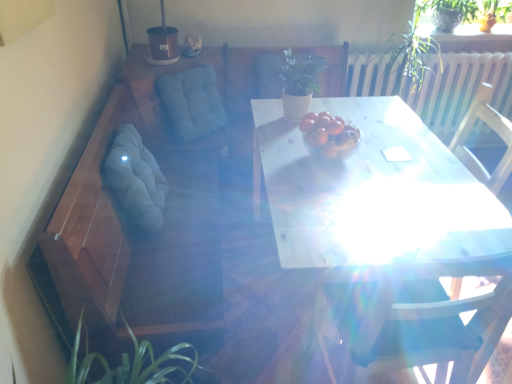
Question: Could you tell me if soft gray fabric swivel chair at left, the second swivel chair from the back, is facing blue fabric cushion at upper left, which appears as the second swivel chair when viewed from the front?

Choices:
 (A) no
 (B) yes

Answer: (A)

Question: Is soft gray fabric swivel chair at left, the second swivel chair from the back, thinner than blue fabric cushion at upper left, which appears as the second swivel chair when viewed from the front?

Choices:
 (A) yes
 (B) no

Answer: (A)

Question: Is soft gray fabric swivel chair at left, marked as the first swivel chair in a front-to-back arrangement, beside blue fabric cushion at upper left, which appears as the 1th swivel chair when viewed from the back?

Choices:
 (A) no
 (B) yes

Answer: (A)

Question: Is blue fabric cushion at upper left, which appears as the second swivel chair when viewed from the front, a part of soft gray fabric swivel chair at left, the second swivel chair from the back?

Choices:
 (A) yes
 (B) no

Answer: (B)

Question: Is soft gray fabric swivel chair at left, the second swivel chair from the back, shorter than blue fabric cushion at upper left, which appears as the 1th swivel chair when viewed from the back?

Choices:
 (A) yes
 (B) no

Answer: (B)

Question: Considering the positions of white glossy table at center and green leafy plant at upper right, the 2th plant positioned from the bottom, in the image, is white glossy table at center wider or thinner than green leafy plant at upper right, the 2th plant positioned from the bottom,?

Choices:
 (A) thin
 (B) wide

Answer: (B)

Question: Considering their positions, is white glossy table at center located in front of or behind green leafy plant at upper right, the 2th plant positioned from the bottom?

Choices:
 (A) behind
 (B) front

Answer: (B)

Question: Considering the positions of point (355, 256) and point (481, 16), is point (355, 256) closer or farther from the camera than point (481, 16)?

Choices:
 (A) farther
 (B) closer

Answer: (B)

Question: From a real-world perspective, is white glossy table at center above or below green leafy plant at upper right, the 2th plant positioned from the bottom?

Choices:
 (A) above
 (B) below

Answer: (B)

Question: Based on their positions, is green fabric armchair at upper center located to the left or right of translucent glass bowl at center?

Choices:
 (A) left
 (B) right

Answer: (A)

Question: Is point (322, 74) closer or farther from the camera than point (311, 119)?

Choices:
 (A) farther
 (B) closer

Answer: (A)

Question: Is green fabric armchair at upper center in front of or behind translucent glass bowl at center in the image?

Choices:
 (A) behind
 (B) front

Answer: (A)

Question: From the image's perspective, is green fabric armchair at upper center above or below translucent glass bowl at center?

Choices:
 (A) below
 (B) above

Answer: (B)

Question: Is green matte plant at center, acting as the 1th plant starting from the bottom, inside or outside of soft gray fabric swivel chair at left, marked as the first swivel chair in a front-to-back arrangement?

Choices:
 (A) inside
 (B) outside

Answer: (B)

Question: Considering their positions, is green matte plant at center, the 2th plant viewed from the right, located in front of or behind soft gray fabric swivel chair at left, marked as the first swivel chair in a front-to-back arrangement?

Choices:
 (A) front
 (B) behind

Answer: (B)